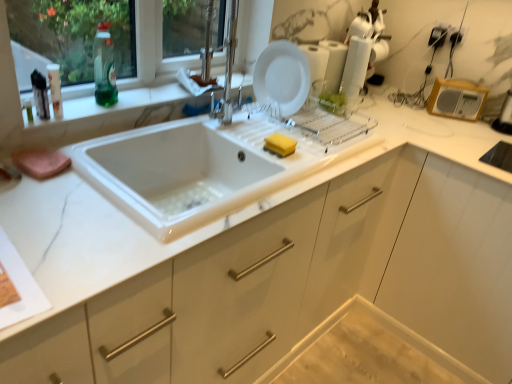
Locate an element on the screen. vacant space to the right of yellow sponge at sink is located at coordinates (318, 154).